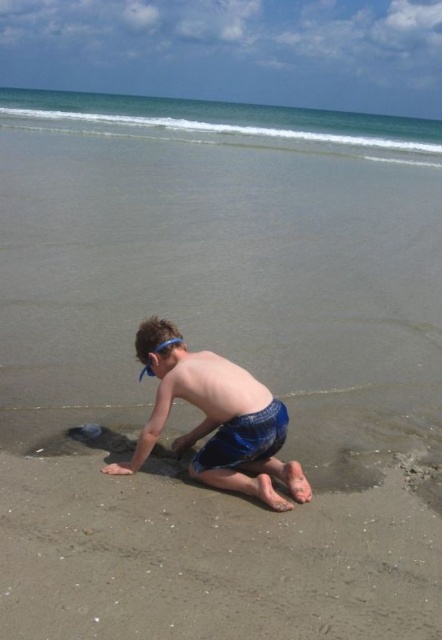
Question: Is blue water at upper center bigger than blue fabric shorts at lower center?

Choices:
 (A) no
 (B) yes

Answer: (B)

Question: Among these points, which one is nearest to the camera?

Choices:
 (A) (118, 96)
 (B) (96, 484)

Answer: (B)

Question: In this image, where is sandy at lower center located relative to blue fabric shorts at lower center?

Choices:
 (A) above
 (B) below

Answer: (B)

Question: Which point is farther from the camera taking this photo?

Choices:
 (A) (240, 368)
 (B) (204, 356)

Answer: (A)

Question: Does blue water at upper center appear on the left side of blue fabric shorts at lower center?

Choices:
 (A) no
 (B) yes

Answer: (B)

Question: Among these points, which one is nearest to the camera?

Choices:
 (A) (250, 403)
 (B) (338, 637)
 (C) (163, 360)
 (D) (358, 154)

Answer: (B)